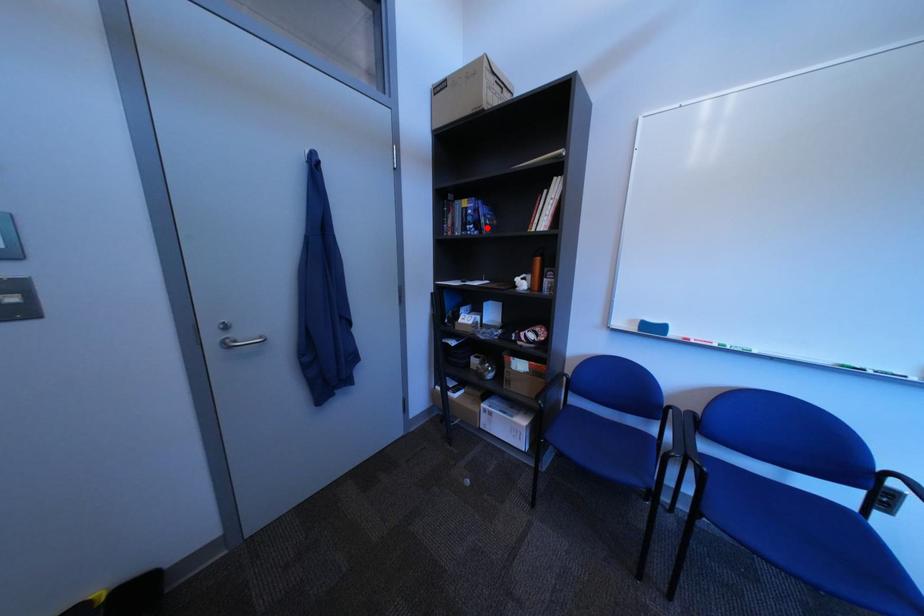
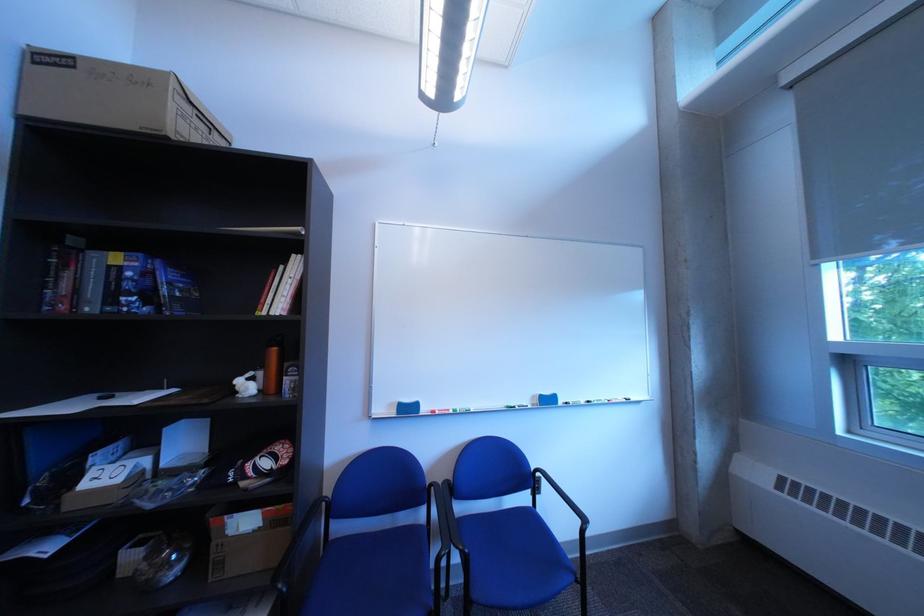
In the second image, find the point that corresponds to the highlighted location in the first image.

(150, 300)